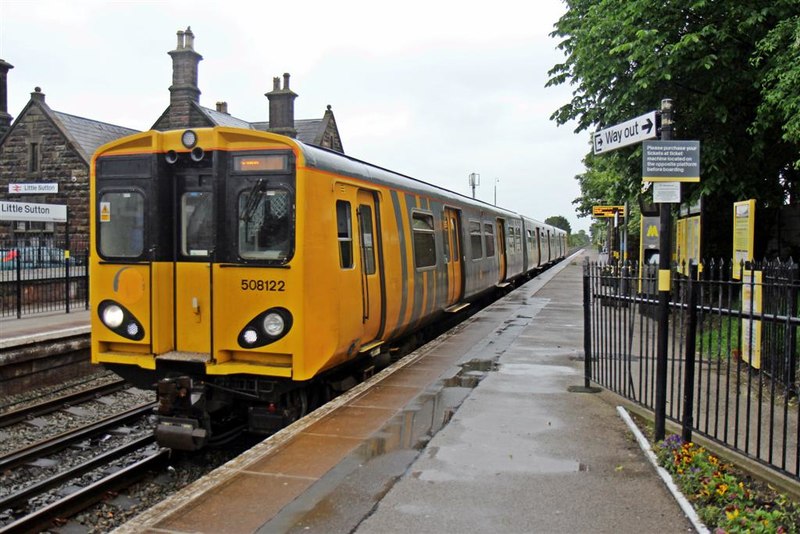
The image size is (800, 534). What are the coordinates of `tray` in the screenshot? It's located at (706, 47).